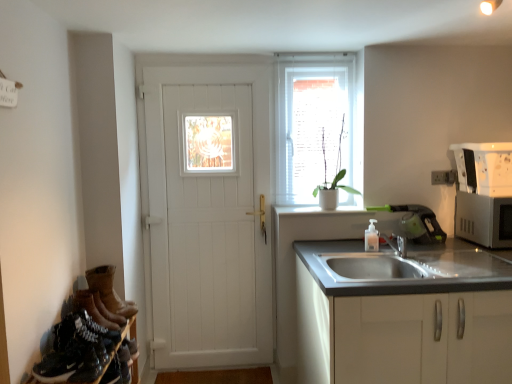
Locate an element on the screen. The image size is (512, 384). empty space that is to the right of translucent plastic soap dispenser at sink right is located at coordinates (398, 246).